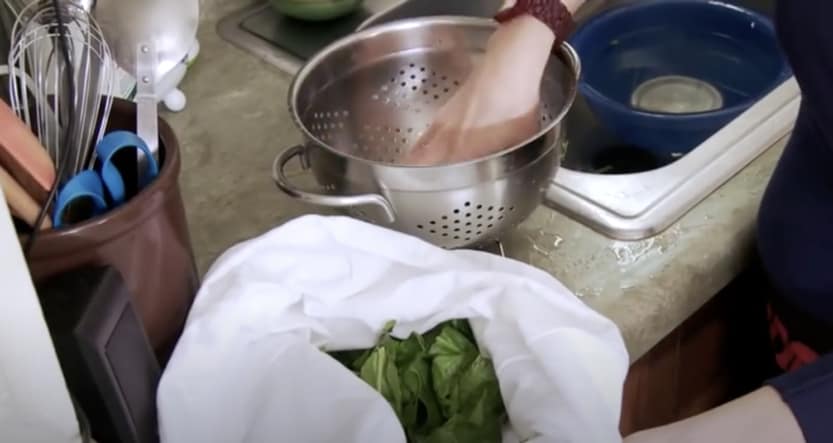
Where is `sink`? The width and height of the screenshot is (833, 443). sink is located at coordinates (585, 175).